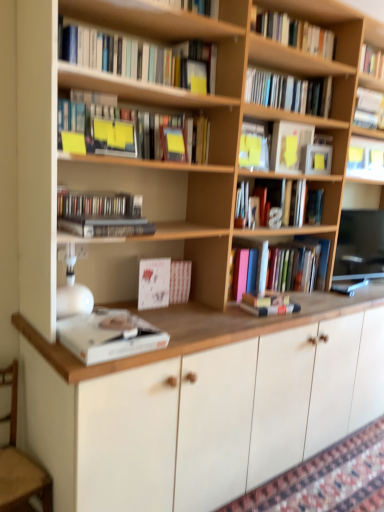
At what (x,y) coordinates should I click in order to perform the action: click on unoccupied region to the right of white textured book at center, acting as the tenth book starting from the top. Please return your answer as a coordinate pair (x, y). Looking at the image, I should click on (202, 307).